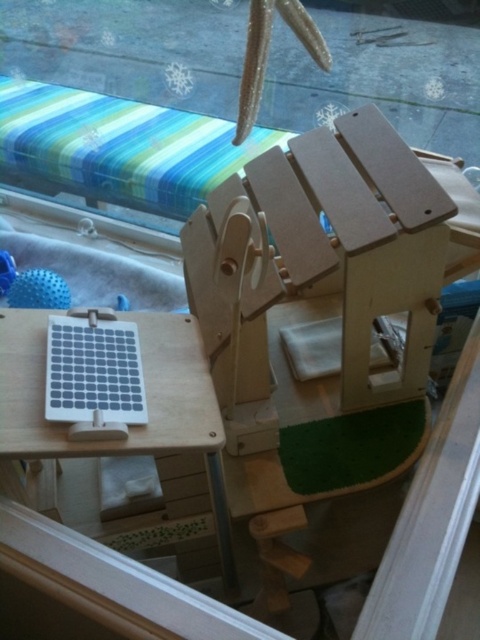
Question: Which object appears closest to the camera in this image?

Choices:
 (A) wooden table at lower left
 (B) white matte solar panel at lower left
 (C) light brown wood beach chair at center

Answer: (A)

Question: Which point is farther to the camera?

Choices:
 (A) light brown wood beach chair at center
 (B) wooden table at lower left

Answer: (A)

Question: Can you confirm if wooden table at lower left is positioned to the left of light brown wood beach chair at center?

Choices:
 (A) yes
 (B) no

Answer: (A)

Question: Among these points, which one is farthest from the camera?

Choices:
 (A) (162, 436)
 (B) (6, 269)

Answer: (B)

Question: Does wooden table at lower left lie in front of blue rubber ball at lower left?

Choices:
 (A) no
 (B) yes

Answer: (B)

Question: Can you confirm if wooden table at lower left is positioned above white matte solar panel at lower left?

Choices:
 (A) yes
 (B) no

Answer: (B)